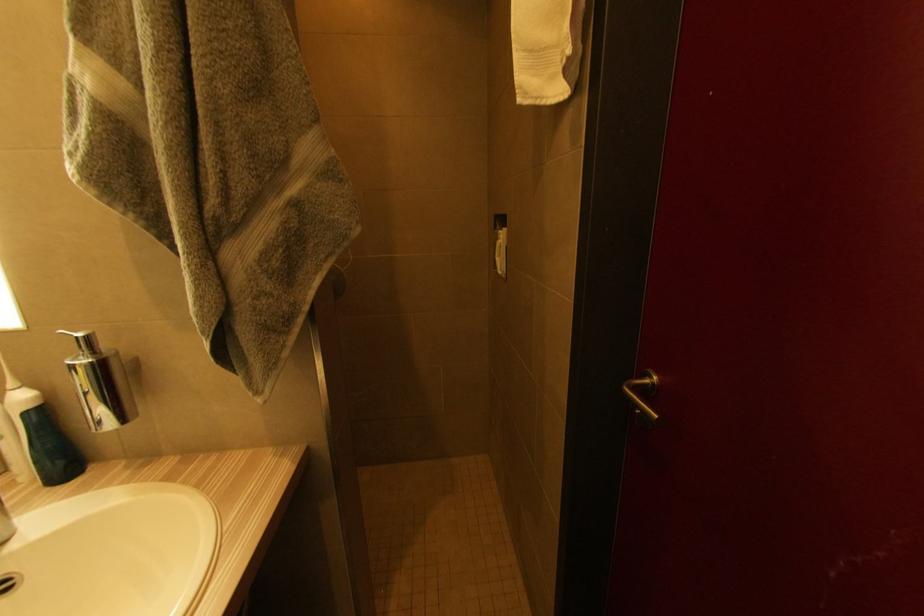
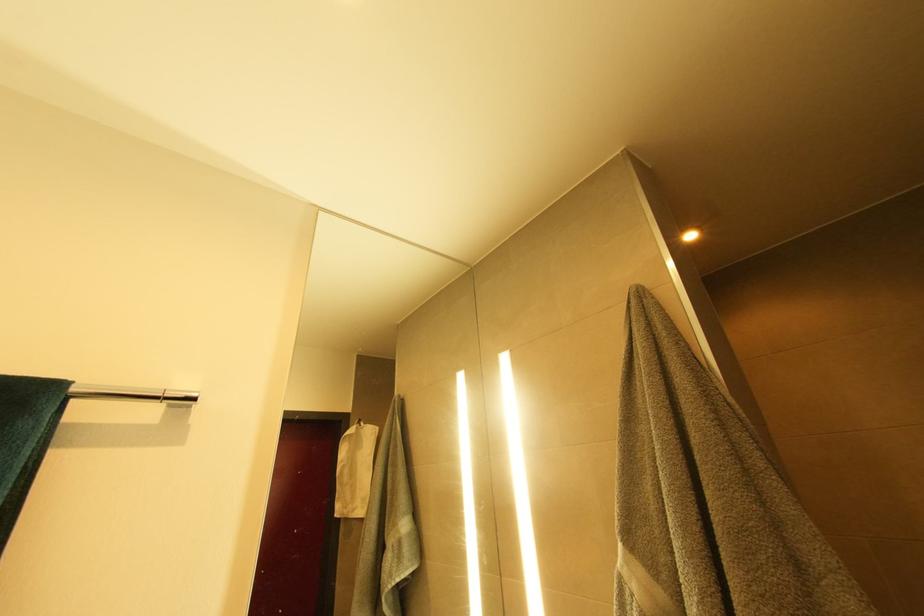
Based on the continuous images, in which direction is the camera rotating?

The camera's rotation is toward left-up.